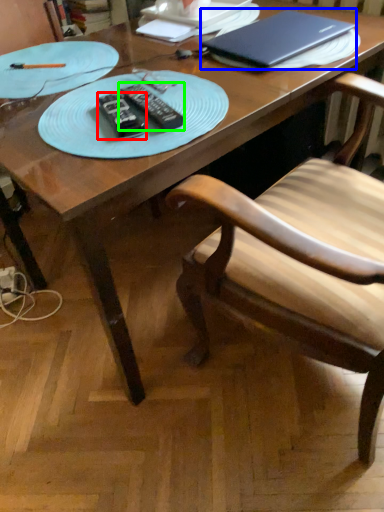
Question: Which is nearer to the remote (highlighted by a red box)? laptop (highlighted by a blue box) or remote (highlighted by a green box).

Choices:
 (A) laptop
 (B) remote

Answer: (B)